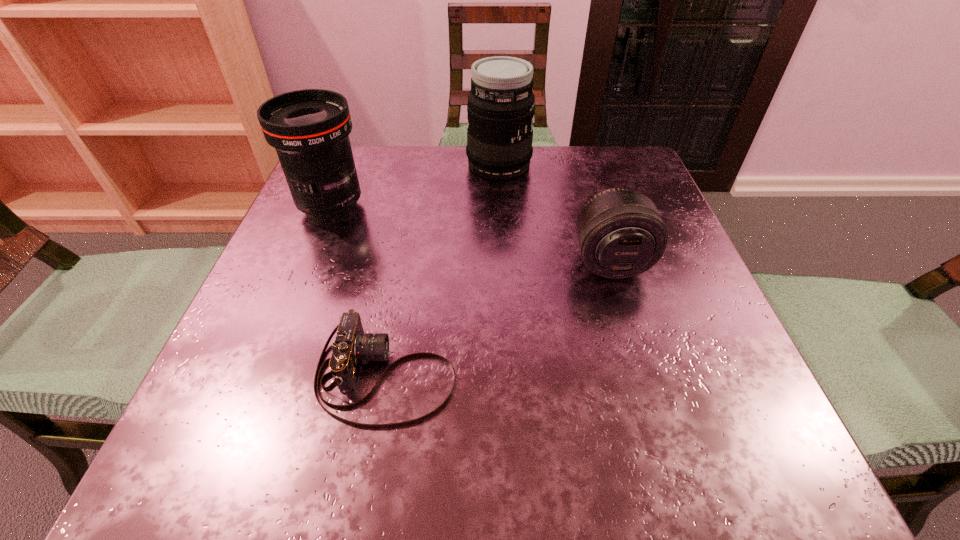
Locate an element on the screen. The width and height of the screenshot is (960, 540). the farthest telephoto lens is located at coordinates (501, 104).

Image resolution: width=960 pixels, height=540 pixels. I want to click on the second telephoto lens from right to left, so click(501, 104).

The width and height of the screenshot is (960, 540). Identify the location of the third nearest object. (309, 128).

Where is `the second farthest telephoto lens`? This screenshot has height=540, width=960. the second farthest telephoto lens is located at coordinates point(309,128).

Locate an element on the screen. Image resolution: width=960 pixels, height=540 pixels. the nearest telephoto lens is located at coordinates (620, 234).

You are a GUI agent. You are given a task and a screenshot of the screen. Output one action in this format:
    pyautogui.click(x=<x>, y=<y>)
    Task: Click on the second nearest object
    This screenshot has width=960, height=540.
    Given the screenshot: What is the action you would take?
    pyautogui.click(x=620, y=234)

At what (x,y) coordinates should I click in order to perform the action: click on the nearest object. Please return your answer as a coordinate pair (x, y). This screenshot has width=960, height=540. Looking at the image, I should click on coord(352,346).

Where is `camera`? The width and height of the screenshot is (960, 540). camera is located at coordinates (352, 346).

Where is `vacant space located on the front of the farthest object`? The image size is (960, 540). vacant space located on the front of the farthest object is located at coordinates (502, 229).

You are a GUI agent. You are given a task and a screenshot of the screen. Output one action in this format:
    pyautogui.click(x=<x>, y=<y>)
    Task: Click on the free space located on the front of the second farthest telephoto lens
    Image resolution: width=960 pixels, height=540 pixels.
    Given the screenshot: What is the action you would take?
    pyautogui.click(x=259, y=386)